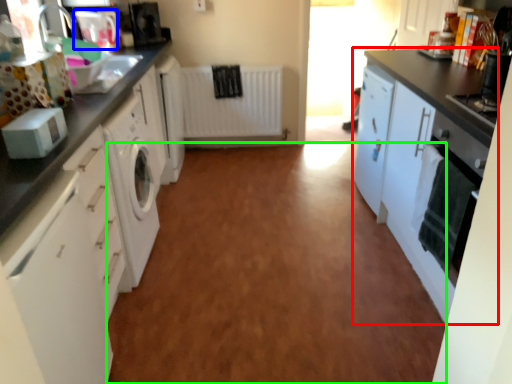
Question: Based on their relative distances, which object is nearer to cabinetry (highlighted by a red box)? Choose from appliance (highlighted by a blue box) and plain (highlighted by a green box).

Choices:
 (A) appliance
 (B) plain

Answer: (B)